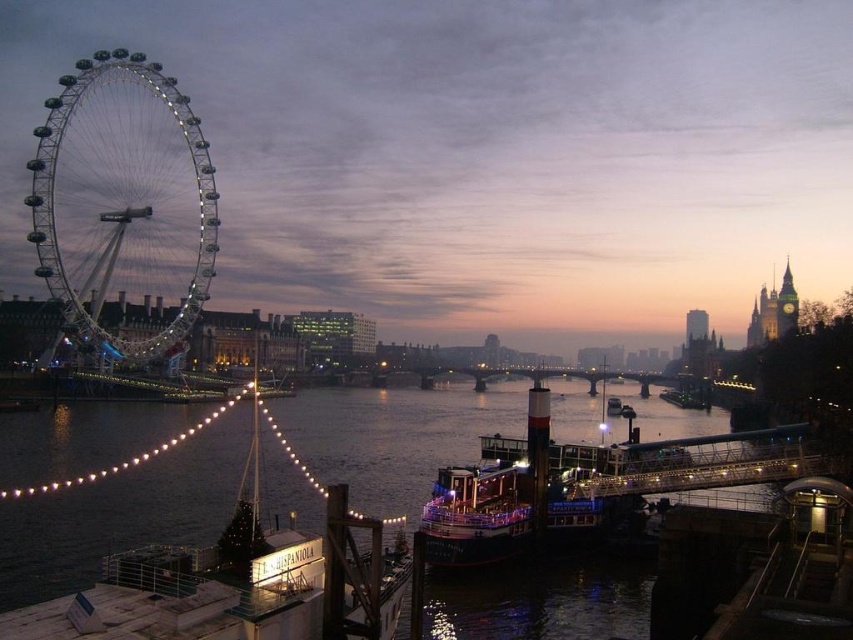
From the picture: Who is more forward, (297, 609) or (132, 355)?

Point (297, 609) is in front.

Can you confirm if dark water at center is bigger than shiny metallic ferris wheel at left?

No.

The height and width of the screenshot is (640, 853). I want to click on dark water at center, so click(238, 584).

Locate an element on the screen. The height and width of the screenshot is (640, 853). dark water at center is located at coordinates coord(238,584).

Is shiny metallic ferris wheel at left thinner than shiny red boat at center?

No.

Is shiny metallic ferris wheel at left shorter than shiny red boat at center?

No.

Identify the location of shiny metallic ferris wheel at left. (123, 200).

Is the position of dark water at center more distant than that of shiny red boat at center?

No.

Does point (341, 589) come behind point (531, 449)?

No, it is in front of (531, 449).

Describe the element at coordinates (238, 584) in the screenshot. Image resolution: width=853 pixels, height=640 pixels. I see `dark water at center` at that location.

Find the location of a particular element. dark water at center is located at coordinates (238, 584).